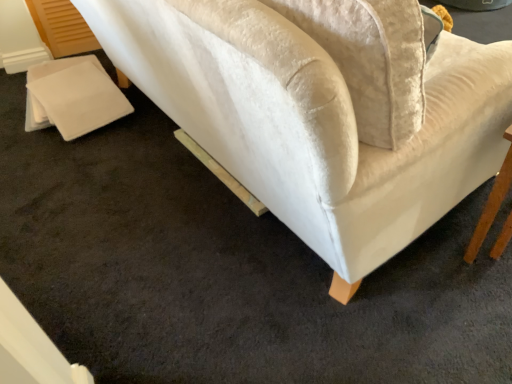
Question: Should I look upward or downward to see velvet white couch at upper right?

Choices:
 (A) up
 (B) down

Answer: (A)

Question: Is velvet white couch at upper right with wooden table at lower right?

Choices:
 (A) yes
 (B) no

Answer: (B)

Question: Is there a large distance between velvet white couch at upper right and wooden table at lower right?

Choices:
 (A) yes
 (B) no

Answer: (B)

Question: Is the depth of velvet white couch at upper right less than that of wooden table at lower right?

Choices:
 (A) yes
 (B) no

Answer: (A)

Question: Is velvet white couch at upper right positioned behind wooden table at lower right?

Choices:
 (A) yes
 (B) no

Answer: (B)

Question: Is velvet white couch at upper right facing towards wooden table at lower right?

Choices:
 (A) no
 (B) yes

Answer: (A)

Question: Is wooden table at lower right at the back of velvet white couch at upper right?

Choices:
 (A) yes
 (B) no

Answer: (B)

Question: Is wooden table at lower right at the right side of velvet white couch at upper right?

Choices:
 (A) yes
 (B) no

Answer: (A)

Question: Considering the relative sizes of wooden table at lower right and velvet white couch at upper right in the image provided, is wooden table at lower right thinner than velvet white couch at upper right?

Choices:
 (A) yes
 (B) no

Answer: (A)

Question: Would you say wooden table at lower right contains velvet white couch at upper right?

Choices:
 (A) yes
 (B) no

Answer: (B)

Question: Does wooden table at lower right have a lesser height compared to velvet white couch at upper right?

Choices:
 (A) yes
 (B) no

Answer: (B)

Question: From the image's perspective, is wooden table at lower right on velvet white couch at upper right?

Choices:
 (A) yes
 (B) no

Answer: (B)

Question: Is wooden table at lower right at the left side of velvet white couch at upper right?

Choices:
 (A) no
 (B) yes

Answer: (A)

Question: From a real-world perspective, is velvet white couch at upper right positioned above or below wooden table at lower right?

Choices:
 (A) below
 (B) above

Answer: (A)